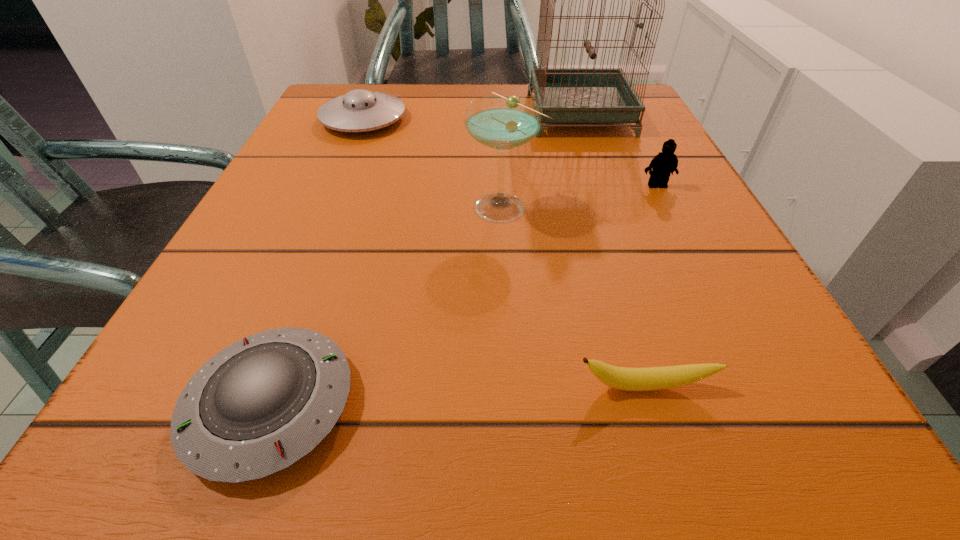
The image size is (960, 540). I want to click on free space between the Lego and the fourth tallest object, so click(510, 152).

This screenshot has height=540, width=960. I want to click on free point between the nearer saucer and the banana, so click(458, 395).

The height and width of the screenshot is (540, 960). In order to click on vacant area that lies between the third object from left to right and the fourth tallest object in this screenshot , I will do `click(434, 163)`.

What are the coordinates of `vacant area that lies between the fifth shortest object and the Lego` in the screenshot? It's located at click(x=581, y=195).

Identify the location of free spot between the banana and the birdcage. This screenshot has height=540, width=960. (612, 250).

Find the location of `free space between the farther saucer and the shorter saucer`. free space between the farther saucer and the shorter saucer is located at coordinates (317, 262).

I want to click on object identified as the fourth closest to the banana, so click(x=567, y=95).

Identify the location of the fifth closest object relative to the third tallest object. (261, 404).